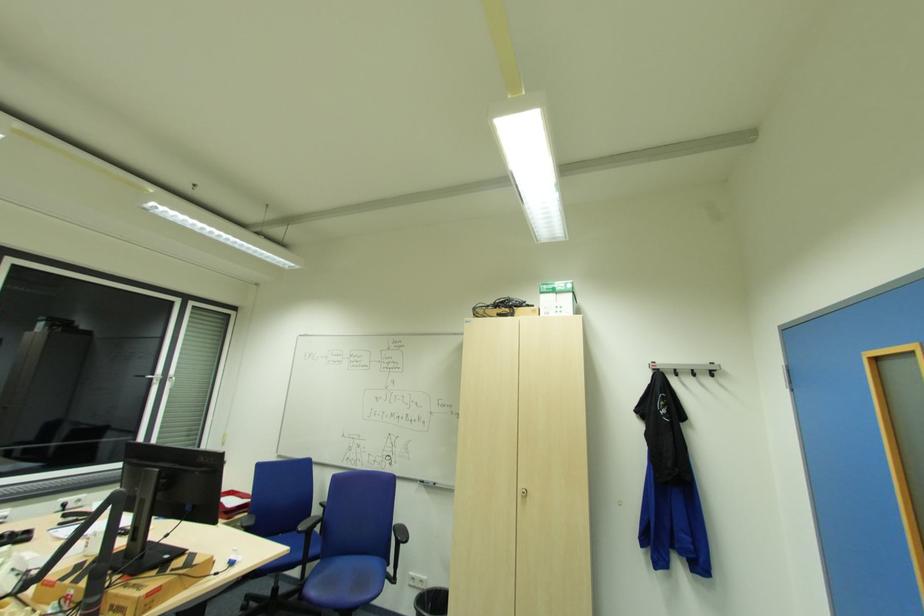
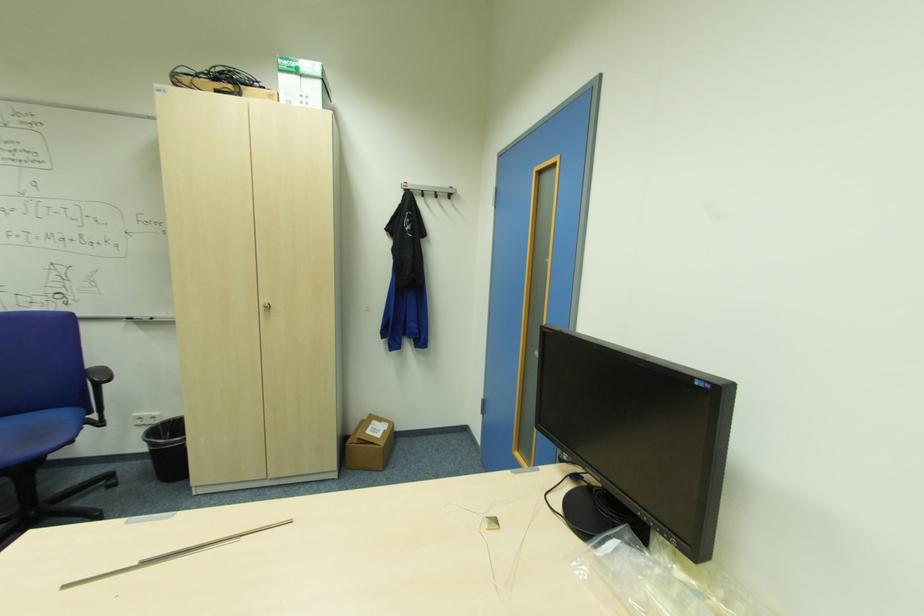
In the second image, find the point that corresponds to (x=407, y=541) in the first image.

(110, 381)